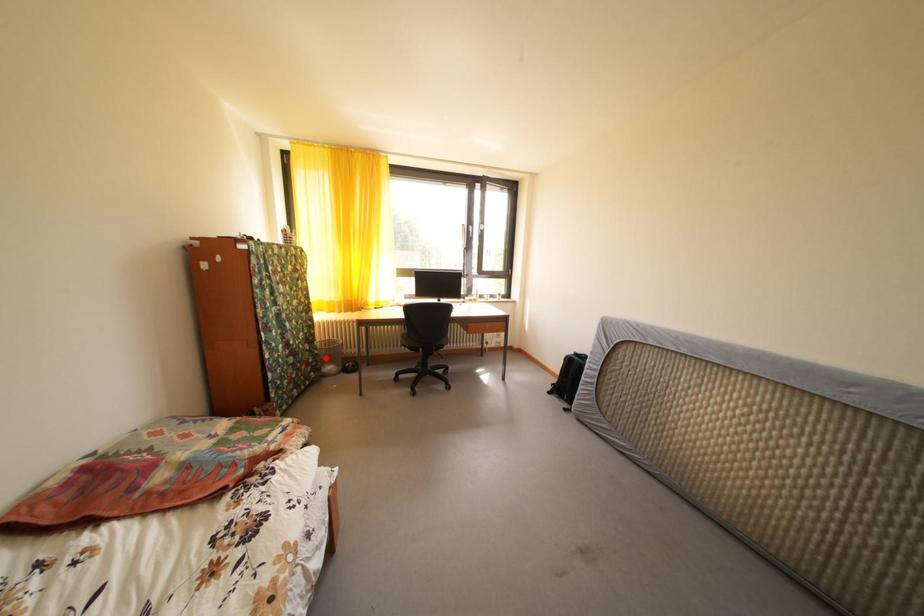
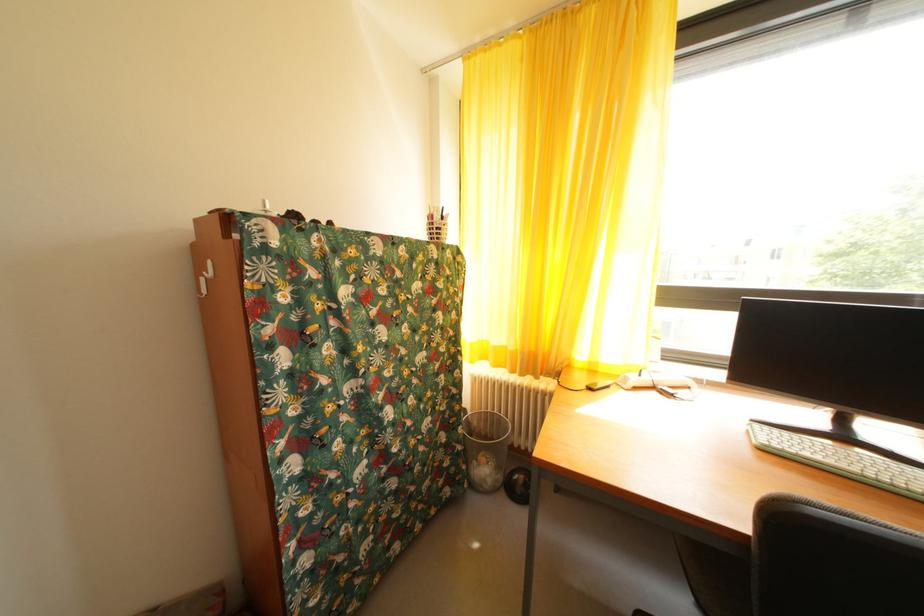
Question: I am providing you with two images of the same scene from different viewpoints. A red point is shown in image1. For the corresponding object point in image2, is it positioned nearer or farther from the camera?

Choices:
 (A) Nearer
 (B) Farther

Answer: (A)